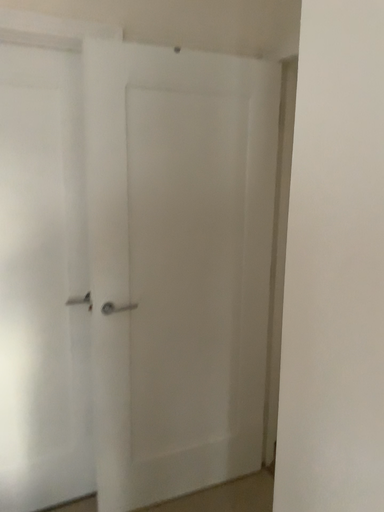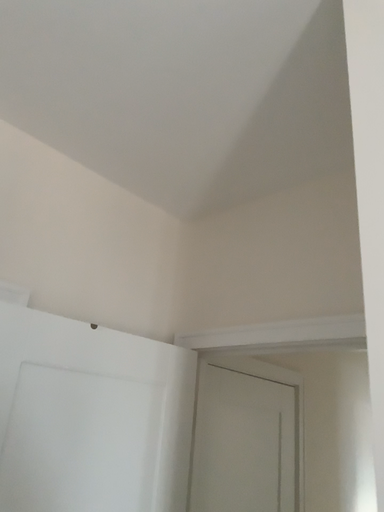
Question: How did the camera likely rotate when shooting the video?

Choices:
 (A) rotated right
 (B) rotated left

Answer: (A)